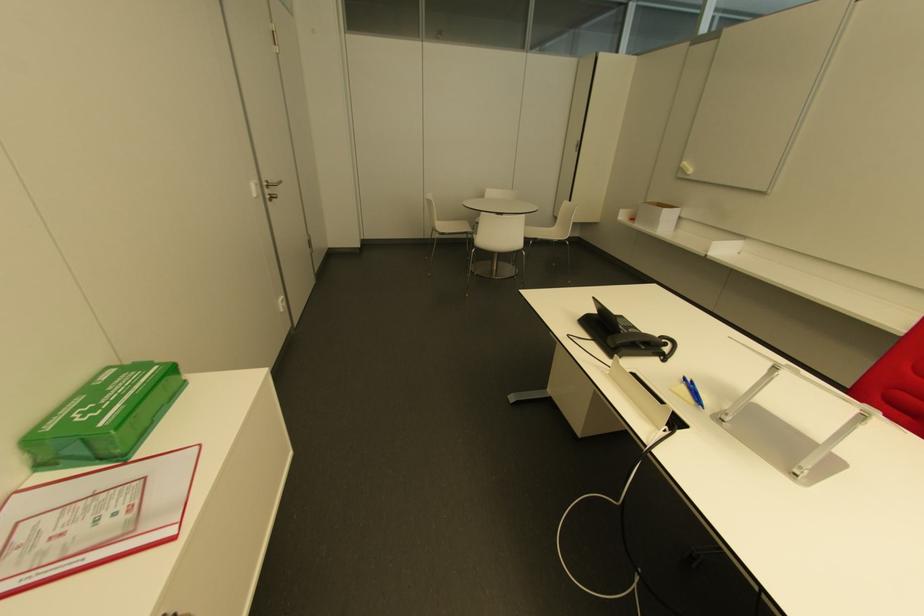
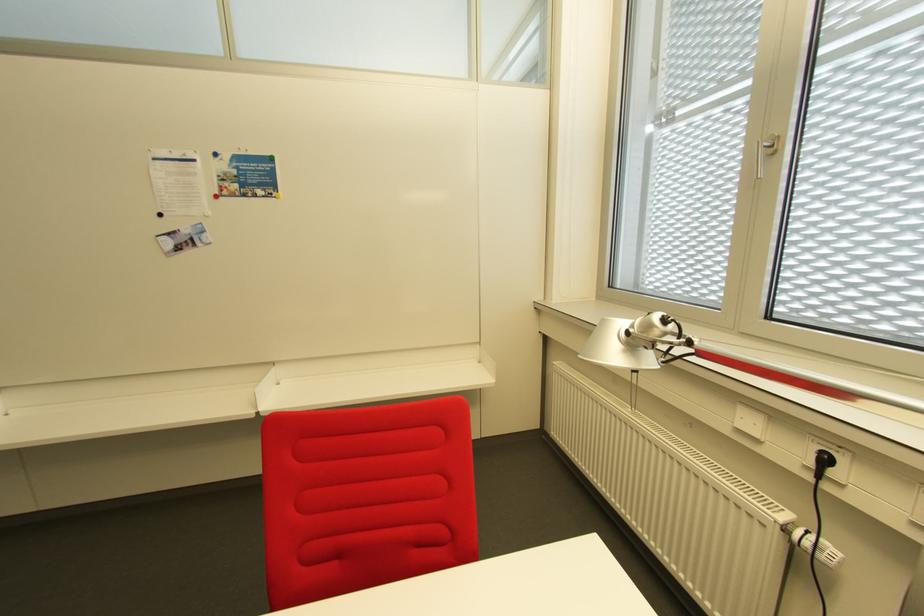
Question: The camera is either moving clockwise (left) or counter-clockwise (right) around the object. The first image is from the beginning of the video and the second image is from the end. Is the camera moving left or right when shooting the video?

Choices:
 (A) Left
 (B) Right

Answer: (A)